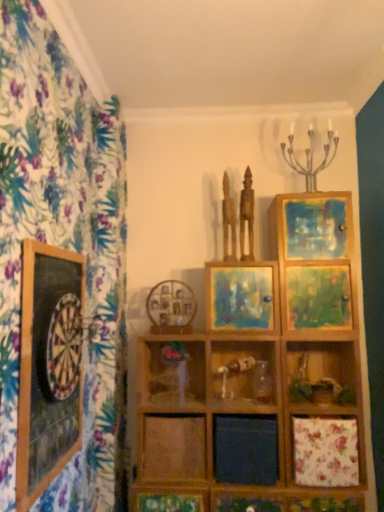
Locate an element on the screen. wooden shelf at center is located at coordinates (x=171, y=371).

The image size is (384, 512). Find the location of `wooden picture frame at center, placed as the first picture frame when sorted from back to front`. wooden picture frame at center, placed as the first picture frame when sorted from back to front is located at coordinates (171, 307).

Image resolution: width=384 pixels, height=512 pixels. What do you see at coordinates (309, 157) in the screenshot?
I see `silver metallic candle holder at upper right` at bounding box center [309, 157].

At what (x,y) coordinates should I click in order to perform the action: click on wooden shelf at center. Please return your answer as a coordinate pair (x, y). The image size is (384, 512). Looking at the image, I should click on (171, 371).

Is silver metallic candle holder at upper right far away from wooden shelf at center?

Yes, silver metallic candle holder at upper right and wooden shelf at center are located far from each other.

Is point (330, 158) farther from viewer compared to point (196, 358)?

That is True.

Consider the image. In terms of height, does silver metallic candle holder at upper right look taller or shorter compared to wooden shelf at center?

In the image, silver metallic candle holder at upper right appears to be taller than wooden shelf at center.

Does silver metallic candle holder at upper right appear on the right side of wooden shelf at center?

Indeed, silver metallic candle holder at upper right is positioned on the right side of wooden shelf at center.

Is wooden statue at center, which is the 1th sculpture in left-to-right order, bigger or smaller than matte brown statue at center, the first sculpture from the right?

In the image, wooden statue at center, which is the 1th sculpture in left-to-right order, appears to be smaller than matte brown statue at center, the first sculpture from the right.

Is point (229, 194) closer to viewer compared to point (243, 258)?

No, it is not.

Which object is more forward, wooden statue at center, which is the 1th sculpture in left-to-right order, or matte brown statue at center, the 2th sculpture when ordered from left to right?

matte brown statue at center, the 2th sculpture when ordered from left to right, is more forward.

Between matte wooden picture frame at center, the second picture frame in the front-to-back sequence, and wooden picture frame at center, placed as the first picture frame when sorted from back to front, which one has smaller size?

With smaller size is wooden picture frame at center, placed as the first picture frame when sorted from back to front.

Locate an element on the screen. picture frame located above the wooden picture frame at center, positioned as the second picture frame in right-to-left order (from the image's perspective) is located at coordinates (242, 297).

How many degrees apart are the facing directions of matte wooden picture frame at center, the second picture frame in the front-to-back sequence, and wooden picture frame at center, acting as the second picture frame starting from the left?

1.55 degrees separate the facing orientations of matte wooden picture frame at center, the second picture frame in the front-to-back sequence, and wooden picture frame at center, acting as the second picture frame starting from the left.

Looking at this image, is there a large distance between matte wooden picture frame at center, which is the third picture frame from left to right, and wooden picture frame at center, placed as the first picture frame when sorted from back to front?

matte wooden picture frame at center, which is the third picture frame from left to right, is actually quite close to wooden picture frame at center, placed as the first picture frame when sorted from back to front.

Which object is positioned more to the right, wooden statue at center, which is the 1th sculpture in left-to-right order, or wooden picture frame at center, placed as the first picture frame when sorted from back to front?

wooden statue at center, which is the 1th sculpture in left-to-right order.

Which object is further away from the camera, wooden statue at center, marked as the second sculpture in a right-to-left arrangement, or wooden picture frame at center, the third picture frame from the front?

wooden statue at center, marked as the second sculpture in a right-to-left arrangement, is more distant.

The image size is (384, 512). In order to click on picture frame that is the 2nd object directly below the wooden statue at center, marked as the second sculpture in a right-to-left arrangement (from a real-world perspective) in this screenshot , I will do `click(171, 307)`.

Can we say wooden statue at center, which is the 1th sculpture in left-to-right order, lies outside wooden picture frame at center, placed as the first picture frame when sorted from back to front?

Yes, wooden statue at center, which is the 1th sculpture in left-to-right order, is not within wooden picture frame at center, placed as the first picture frame when sorted from back to front.

Would you say wooden picture frame at center, placed as the first picture frame when sorted from back to front, is part of matte brown statue at center, the 2th sculpture when ordered from left to right,'s contents?

Actually, wooden picture frame at center, placed as the first picture frame when sorted from back to front, is outside matte brown statue at center, the 2th sculpture when ordered from left to right.

From a real-world perspective, is matte brown statue at center, the first sculpture from the right, physically located above or below wooden picture frame at center, placed as the first picture frame when sorted from back to front?

matte brown statue at center, the first sculpture from the right, is situated higher than wooden picture frame at center, placed as the first picture frame when sorted from back to front, in the real world.

Does point (227, 303) lie in front of point (57, 464)?

No, it is not.

From a real-world perspective, is matte wooden picture frame at center, which is the third picture frame from left to right, over wooden dartboard at left, arranged as the third picture frame when viewed from the back?

Yes, from a real-world perspective, matte wooden picture frame at center, which is the third picture frame from left to right, is on top of wooden dartboard at left, arranged as the third picture frame when viewed from the back.

In the image, is matte wooden picture frame at center, the second picture frame in the front-to-back sequence, positioned in front of or behind wooden dartboard at left, arranged as the third picture frame when viewed from the back?

matte wooden picture frame at center, the second picture frame in the front-to-back sequence, is positioned farther from the viewer than wooden dartboard at left, arranged as the third picture frame when viewed from the back.

Considering the sizes of objects wooden picture frame at center, positioned as the second picture frame in right-to-left order, and wooden statue at center, marked as the second sculpture in a right-to-left arrangement, in the image provided, who is bigger, wooden picture frame at center, positioned as the second picture frame in right-to-left order, or wooden statue at center, marked as the second sculpture in a right-to-left arrangement,?

With larger size is wooden picture frame at center, positioned as the second picture frame in right-to-left order.

Is wooden picture frame at center, acting as the second picture frame starting from the left, inside or outside of wooden statue at center, marked as the second sculpture in a right-to-left arrangement?

wooden picture frame at center, acting as the second picture frame starting from the left, is not inside wooden statue at center, marked as the second sculpture in a right-to-left arrangement, it's outside.

Which object is positioned more to the right, wooden picture frame at center, the third picture frame from the front, or wooden statue at center, which is the 1th sculpture in left-to-right order?

From the viewer's perspective, wooden statue at center, which is the 1th sculpture in left-to-right order, appears more on the right side.

From a real-world perspective, relative to wooden statue at center, which is the 1th sculpture in left-to-right order, is wooden picture frame at center, acting as the second picture frame starting from the left, vertically above or below?

In terms of real-world spatial position, wooden picture frame at center, acting as the second picture frame starting from the left, is below wooden statue at center, which is the 1th sculpture in left-to-right order.

Where is `candle holder that is in front of the wooden shelf at center`? This screenshot has height=512, width=384. candle holder that is in front of the wooden shelf at center is located at coordinates (309, 157).

You are a GUI agent. You are given a task and a screenshot of the screen. Output one action in this format:
    pyautogui.click(x=<x>, y=<y>)
    Task: Click on the sculpture below the wooden statue at center, marked as the second sculpture in a right-to-left arrangement (from a real-world perspective)
    
    Given the screenshot: What is the action you would take?
    pyautogui.click(x=247, y=215)

Looking at the image, which one is located further to wooden statue at center, which is the 1th sculpture in left-to-right order, silver metallic candle holder at upper right or wooden dartboard at left, arranged as the third picture frame when viewed from the back?

Among the two, wooden dartboard at left, arranged as the third picture frame when viewed from the back, is located further to wooden statue at center, which is the 1th sculpture in left-to-right order.

From the image, which object appears to be nearer to silver metallic candle holder at upper right, matte wooden picture frame at center, which is the third picture frame from left to right, or wooden picture frame at center, acting as the second picture frame starting from the left?

matte wooden picture frame at center, which is the third picture frame from left to right.

Which object lies nearer to the anchor point wooden dartboard at left, which appears as the 3th picture frame when viewed from the right, wooden statue at center, which is the 1th sculpture in left-to-right order, or matte brown statue at center, the first sculpture from the right?

Based on the image, wooden statue at center, which is the 1th sculpture in left-to-right order, appears to be nearer to wooden dartboard at left, which appears as the 3th picture frame when viewed from the right.

From the image, which object appears to be farther from wooden picture frame at center, acting as the second picture frame starting from the left, matte brown statue at center, the 2th sculpture when ordered from left to right, or matte wooden picture frame at center, the 2th picture frame in the back-to-front sequence?

Based on the image, matte brown statue at center, the 2th sculpture when ordered from left to right, appears to be further to wooden picture frame at center, acting as the second picture frame starting from the left.

From the image, which object appears to be farther from matte brown statue at center, the first sculpture from the right, wooden shelf at center or silver metallic candle holder at upper right?

wooden shelf at center is positioned further to the anchor matte brown statue at center, the first sculpture from the right.

Estimate the real-world distances between objects in this image. Which object is closer to matte wooden picture frame at center, the 2th picture frame in the back-to-front sequence, wooden statue at center, marked as the second sculpture in a right-to-left arrangement, or matte brown statue at center, the first sculpture from the right?

Based on the image, wooden statue at center, marked as the second sculpture in a right-to-left arrangement, appears to be nearer to matte wooden picture frame at center, the 2th picture frame in the back-to-front sequence.

Considering their positions, is silver metallic candle holder at upper right positioned closer to matte brown statue at center, the 2th sculpture when ordered from left to right, than wooden picture frame at center, placed as the first picture frame when sorted from back to front?

silver metallic candle holder at upper right.

When comparing their distances from wooden statue at center, marked as the second sculpture in a right-to-left arrangement, does matte wooden picture frame at center, the 2th picture frame in the back-to-front sequence, or wooden dartboard at left, which appears as the 3th picture frame when viewed from the right, seem further?

The object further to wooden statue at center, marked as the second sculpture in a right-to-left arrangement, is wooden dartboard at left, which appears as the 3th picture frame when viewed from the right.

The width and height of the screenshot is (384, 512). What are the coordinates of `picture frame between silver metallic candle holder at upper right and wooden picture frame at center, acting as the second picture frame starting from the left, vertically` in the screenshot? It's located at (242, 297).

The image size is (384, 512). Identify the location of sculpture between matte brown statue at center, the first sculpture from the right, and wooden shelf at center vertically. (228, 220).

You are a GUI agent. You are given a task and a screenshot of the screen. Output one action in this format:
    pyautogui.click(x=<x>, y=<y>)
    Task: Click on the shelf positioned between wooden dartboard at left, which appears as the 3th picture frame when viewed from the right, and matte brown statue at center, the 2th sculpture when ordered from left to right, from near to far
    The width and height of the screenshot is (384, 512).
    Given the screenshot: What is the action you would take?
    pyautogui.click(x=171, y=371)

At what (x,y) coordinates should I click in order to perform the action: click on picture frame located between wooden dartboard at left, which appears as the 3th picture frame when viewed from the right, and wooden shelf at center in the depth direction. Please return your answer as a coordinate pair (x, y). Looking at the image, I should click on (242, 297).